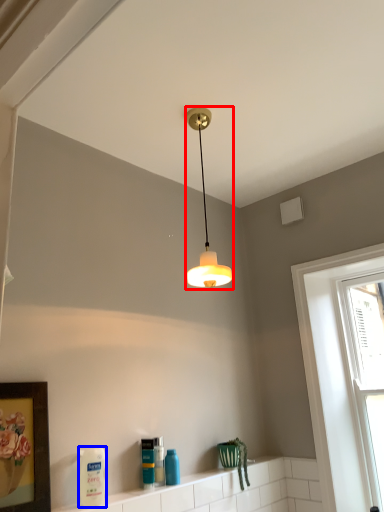
Question: Among these objects, which one is nearest to the camera, lamp (highlighted by a red box) or cleaning product (highlighted by a blue box)?

Choices:
 (A) lamp
 (B) cleaning product

Answer: (B)